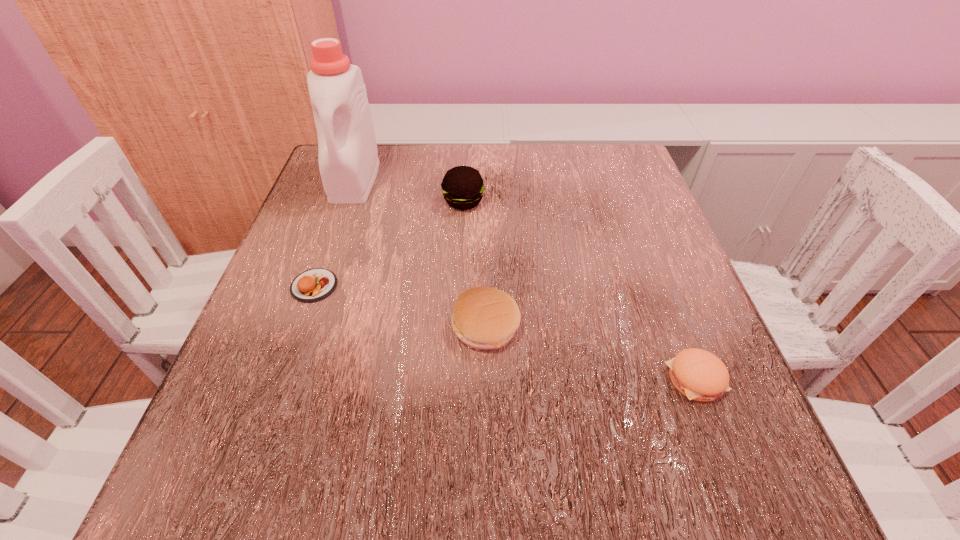
Where is `blank area located 0.380m on the back of the third shortest patty (food)`? This screenshot has width=960, height=540. blank area located 0.380m on the back of the third shortest patty (food) is located at coordinates (484, 177).

Locate an element on the screen. The height and width of the screenshot is (540, 960). vacant space positioned 0.190m on the left of the nearest object is located at coordinates (538, 379).

The height and width of the screenshot is (540, 960). I want to click on free region located 0.090m on the front of the shortest patty (food), so click(293, 347).

Where is `detergent present at the far edge`? detergent present at the far edge is located at coordinates (348, 159).

The width and height of the screenshot is (960, 540). What are the coordinates of `patty located at the far edge` in the screenshot? It's located at (462, 186).

Locate an element on the screen. This screenshot has width=960, height=540. detergent located at the left edge is located at coordinates (348, 159).

The image size is (960, 540). Identify the location of patty (food) that is at the left edge. (312, 285).

The height and width of the screenshot is (540, 960). What are the coordinates of `object that is positioned at the right edge` in the screenshot? It's located at (698, 374).

Image resolution: width=960 pixels, height=540 pixels. I want to click on object at the far left corner, so click(348, 159).

This screenshot has height=540, width=960. Identify the location of blank space at the far edge of the desktop. (494, 147).